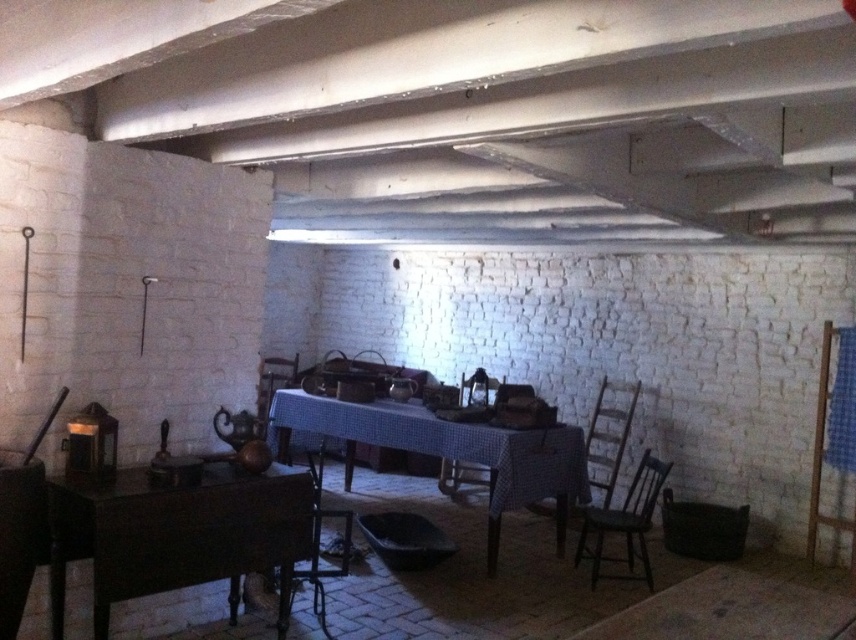
You are hosting a dinner party and need to place a large platter on the table. Given the blue checkered tablecloth at center and the wooden chair at lower left, which object determines the maximum width available for placing the platter?

The blue checkered tablecloth at center determines the maximum width available for placing the platter because it is wider than the wooden chair at lower left.

You are standing at the entrance of the room and want to sit down. The dark brown wooden chair at lower right is your only option. Can you reach it without moving any other furniture?

The dark brown wooden chair at lower right is located at point (625, 522), so yes, you can reach it without moving any other furniture as there is no obstruction mentioned in the scene description.

You are a guest entering the rustic room and need to sit down. You see a dark brown wooden chair at lower right and a wooden chair at lower left. Which chair is taller?

The dark brown wooden chair at lower right is much taller than the wooden chair at lower left.